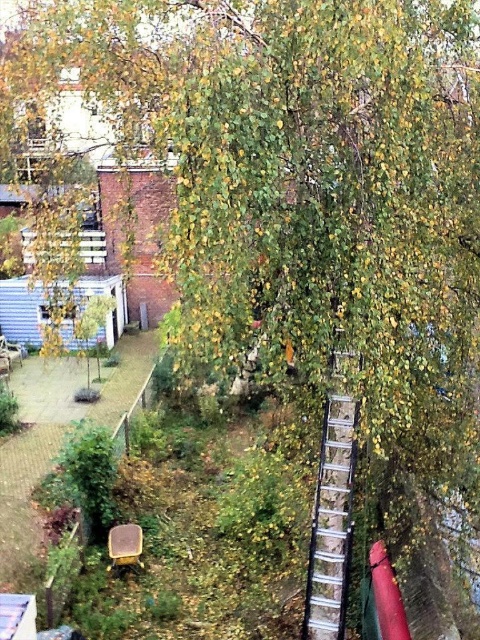
Which of these two, silver metallic ladder at upper center or matte yellow chair at lower center, stands taller?

Standing taller between the two is silver metallic ladder at upper center.

Identify the location of silver metallic ladder at upper center. (332, 522).

Locate an element on the screen. silver metallic ladder at upper center is located at coordinates (332, 522).